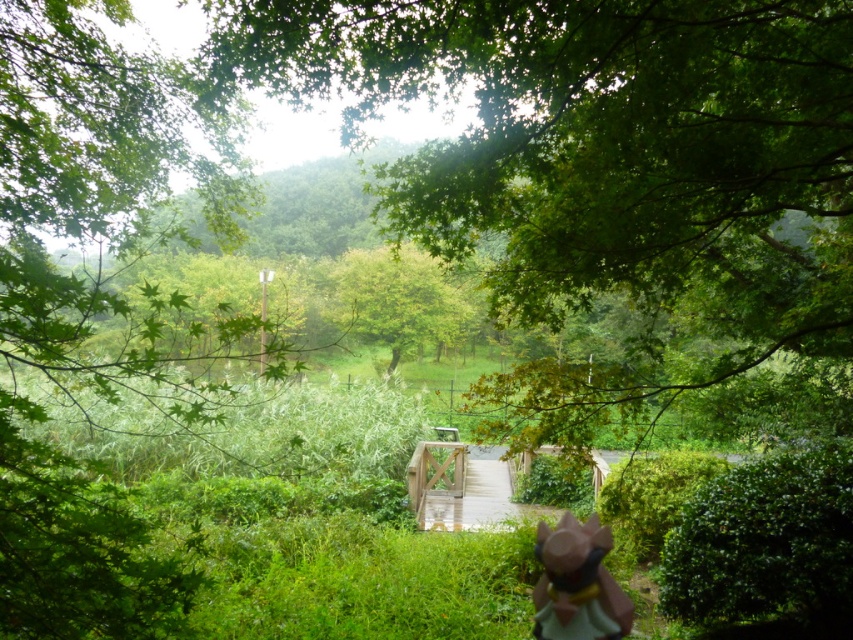
Measure the distance between green leafy tree at center and pink matte figurine at lower center.

They are 16.13 feet apart.

Is green leafy tree at center below pink matte figurine at lower center?

Incorrect, green leafy tree at center is not positioned below pink matte figurine at lower center.

What are the coordinates of `green leafy tree at center` in the screenshot? It's located at (602, 180).